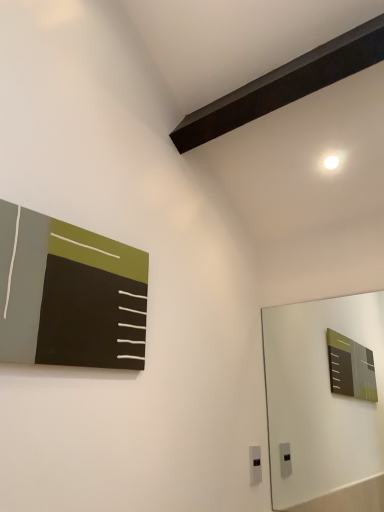
Question: Considering the relative sizes of black plastic electric outlet at lower center and matte black board at upper left in the image provided, is black plastic electric outlet at lower center shorter than matte black board at upper left?

Choices:
 (A) yes
 (B) no

Answer: (A)

Question: Does black plastic electric outlet at lower center lie behind matte black board at upper left?

Choices:
 (A) no
 (B) yes

Answer: (B)

Question: Considering the relative positions of black plastic electric outlet at lower center and matte black board at upper left in the image provided, is black plastic electric outlet at lower center to the right of matte black board at upper left from the viewer's perspective?

Choices:
 (A) no
 (B) yes

Answer: (B)

Question: From the image's perspective, would you say black plastic electric outlet at lower center is positioned over matte black board at upper left?

Choices:
 (A) no
 (B) yes

Answer: (A)

Question: Is black plastic electric outlet at lower center positioned in front of matte black board at upper left?

Choices:
 (A) no
 (B) yes

Answer: (A)

Question: Is black plastic electric outlet at lower center taller than matte black board at upper left?

Choices:
 (A) yes
 (B) no

Answer: (B)

Question: Is matte black board at upper left to the left of black plastic electric outlet at lower center from the viewer's perspective?

Choices:
 (A) yes
 (B) no

Answer: (A)

Question: Is matte black board at upper left directly adjacent to black plastic electric outlet at lower center?

Choices:
 (A) yes
 (B) no

Answer: (B)

Question: Could you tell me if matte black board at upper left is facing black plastic electric outlet at lower center?

Choices:
 (A) yes
 (B) no

Answer: (B)

Question: Is matte black board at upper left positioned in front of black plastic electric outlet at lower center?

Choices:
 (A) no
 (B) yes

Answer: (B)

Question: From the image's perspective, is matte black board at upper left under black plastic electric outlet at lower center?

Choices:
 (A) yes
 (B) no

Answer: (B)

Question: Is matte black board at upper left smaller than black plastic electric outlet at lower center?

Choices:
 (A) no
 (B) yes

Answer: (A)

Question: Would you say black plastic electric outlet at lower center is to the left or to the right of matte black board at upper left in the picture?

Choices:
 (A) right
 (B) left

Answer: (A)